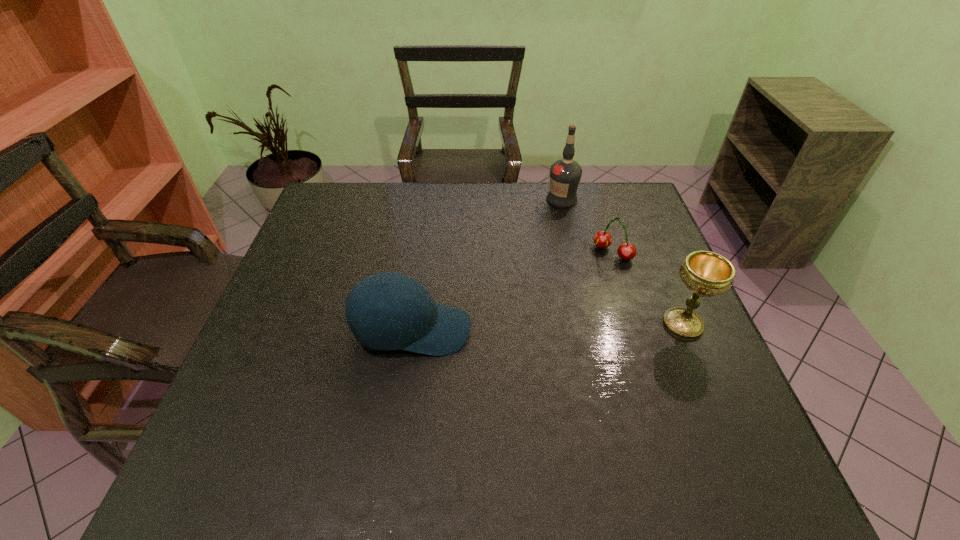
Locate an element on the screen. The width and height of the screenshot is (960, 540). vacant space on the desktop that is between the third tallest object and the rightmost object and is positioned with stems pointing upwards on the shortest object is located at coordinates (528, 327).

Find the location of a particular element. free space on the desktop that is between the third tallest object and the third shortest object and is positioned on the front label of the farthest object is located at coordinates (522, 328).